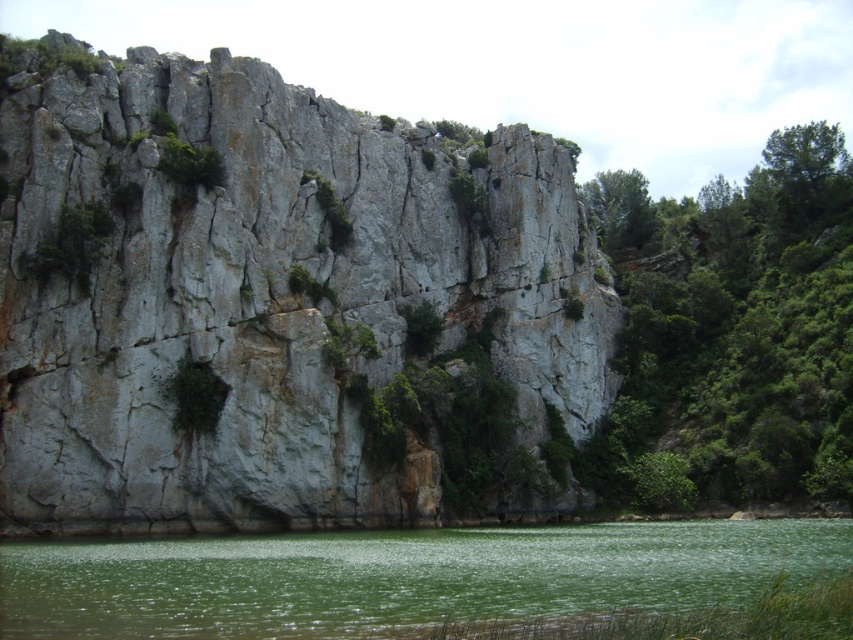
Question: Based on their relative distances, which object is nearer to the gray rough rock face at center?

Choices:
 (A) green leafy shrub at right
 (B) green leafy tree at upper center

Answer: (A)

Question: Can you confirm if green leafy shrub at right is thinner than green smooth water at lower center?

Choices:
 (A) yes
 (B) no

Answer: (B)

Question: Does green smooth water at lower center come in front of green leafy tree at upper center?

Choices:
 (A) yes
 (B) no

Answer: (A)

Question: Does green leafy shrub at right have a lesser width compared to green mossy rock at center?

Choices:
 (A) yes
 (B) no

Answer: (B)

Question: Among these points, which one is farthest from the camera?

Choices:
 (A) (521, 531)
 (B) (601, 225)
 (C) (752, 387)
 (D) (329, 192)

Answer: (B)

Question: Estimate the real-world distances between objects in this image. Which object is closer to the green leafy shrub at right?

Choices:
 (A) green mossy rock at center
 (B) green smooth water at lower center
 (C) green leafy tree at upper center
 (D) gray rough rock face at center

Answer: (C)